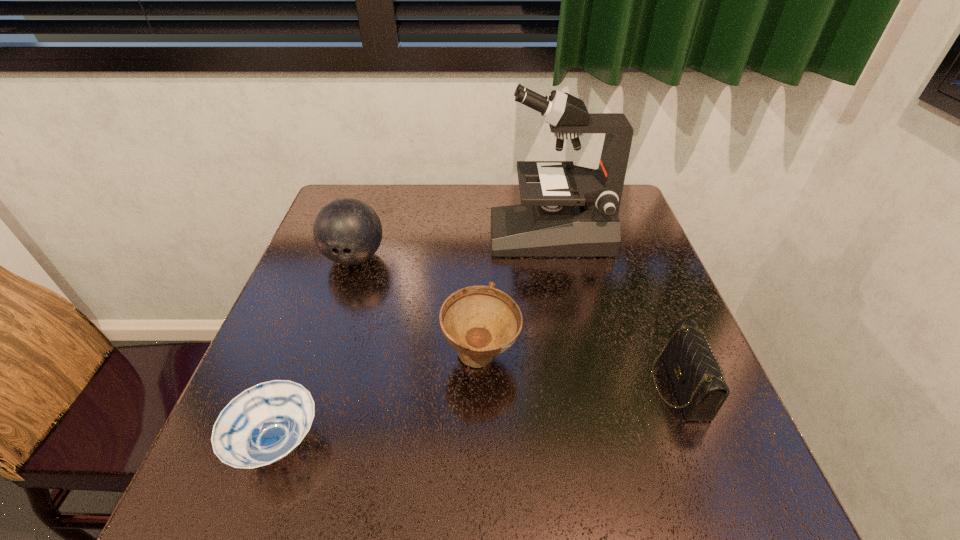
In order to click on vacant area situated 0.230m on the grip area of the second tallest object in this screenshot , I will do `click(323, 354)`.

Identify the location of vacant space located 0.280m on the back of the taller soup bowl. This screenshot has width=960, height=540. (481, 248).

Identify the location of vacant space located 0.400m on the front flap of the fourth tallest object. (446, 384).

Image resolution: width=960 pixels, height=540 pixels. Find the location of `free location located on the front flap of the fourth tallest object`. free location located on the front flap of the fourth tallest object is located at coordinates (587, 384).

Where is `free space located 0.220m on the front flap of the fourth tallest object`? This screenshot has height=540, width=960. free space located 0.220m on the front flap of the fourth tallest object is located at coordinates (540, 384).

What are the coordinates of `vacant region located 0.350m on the back of the left soup bowl` in the screenshot? It's located at (337, 277).

The height and width of the screenshot is (540, 960). Identify the location of object that is at the far edge. (573, 212).

Identify the location of object located in the near edge section of the desktop. This screenshot has height=540, width=960. (265, 423).

Locate an element on the screen. The height and width of the screenshot is (540, 960). bowling ball positioned at the left edge is located at coordinates (347, 231).

The width and height of the screenshot is (960, 540). Identify the location of soup bowl situated at the left edge. (265, 423).